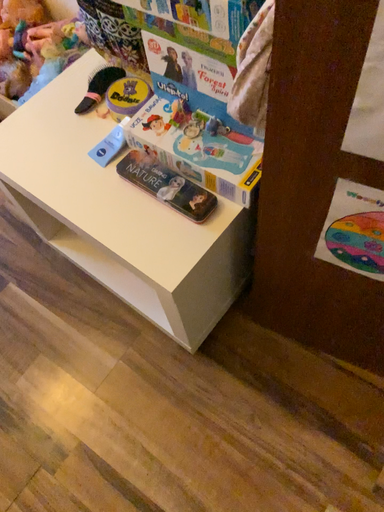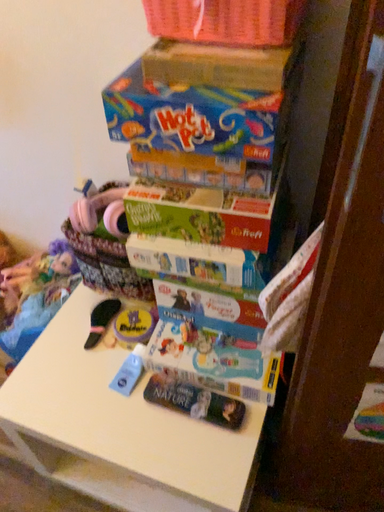
Question: How did the camera likely rotate when shooting the video?

Choices:
 (A) rotated right
 (B) rotated left

Answer: (A)